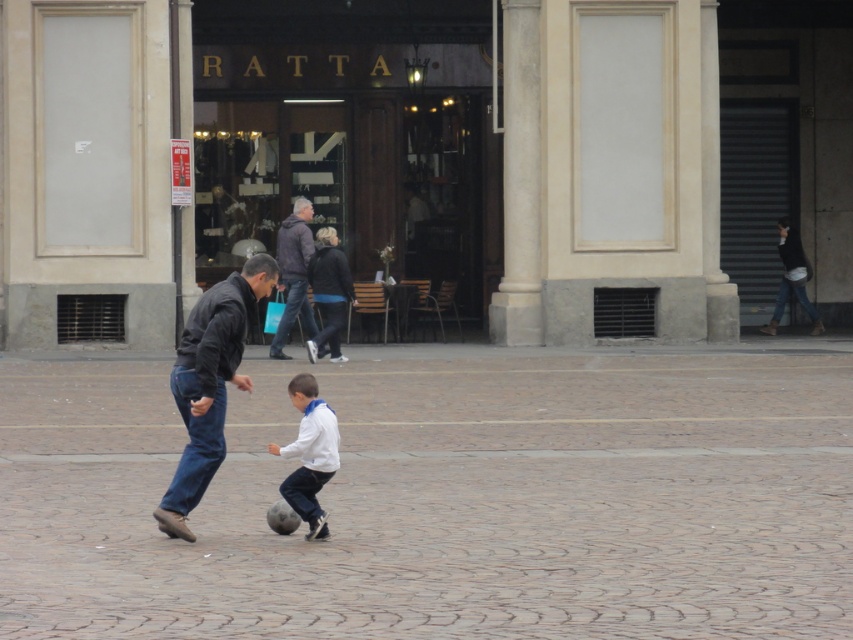
Is white matte shirt at center smaller than dark brown leather jacket at center?

Yes, white matte shirt at center is smaller than dark brown leather jacket at center.

How distant is white matte shirt at center from dark brown leather jacket at center?

44.12 feet

Between point (314, 392) and point (287, 284), which one is positioned behind?

The point (287, 284) is behind.

This screenshot has width=853, height=640. I want to click on white matte shirt at center, so click(309, 452).

Is point (184, 340) positioned behind point (289, 253)?

No, it is not.

Who is taller, dark blue jeans at center or dark brown leather jacket at center?

dark brown leather jacket at center

Measure the distance between dark blue jeans at center and camera.

10.94 meters

This screenshot has height=640, width=853. I want to click on dark blue jeans at center, so click(209, 384).

Which is behind, point (175, 486) or point (309, 492)?

The point (175, 486) is more distant.

Which is more to the right, dark blue jeans at center or white matte shirt at center?

white matte shirt at center is more to the right.

Is point (193, 492) behind point (318, 480)?

Yes.

This screenshot has width=853, height=640. I want to click on dark blue jeans at center, so click(209, 384).